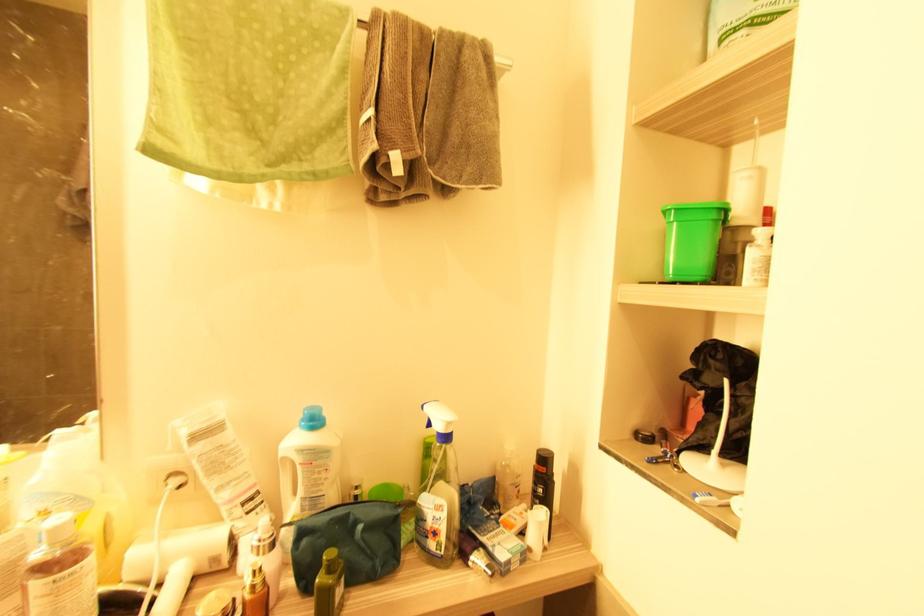
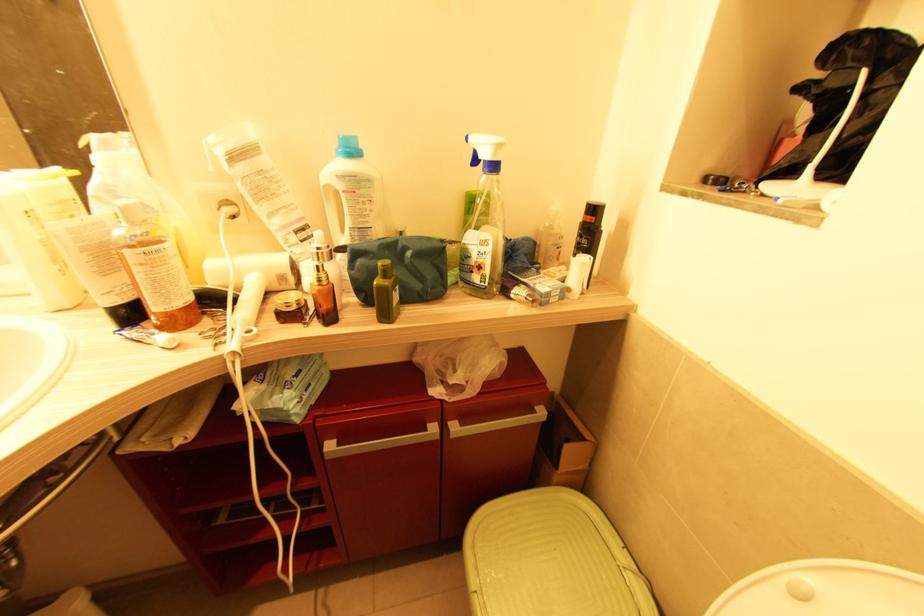
Locate, in the second image, the point that corresponds to point 177,483 in the first image.

(229, 211)